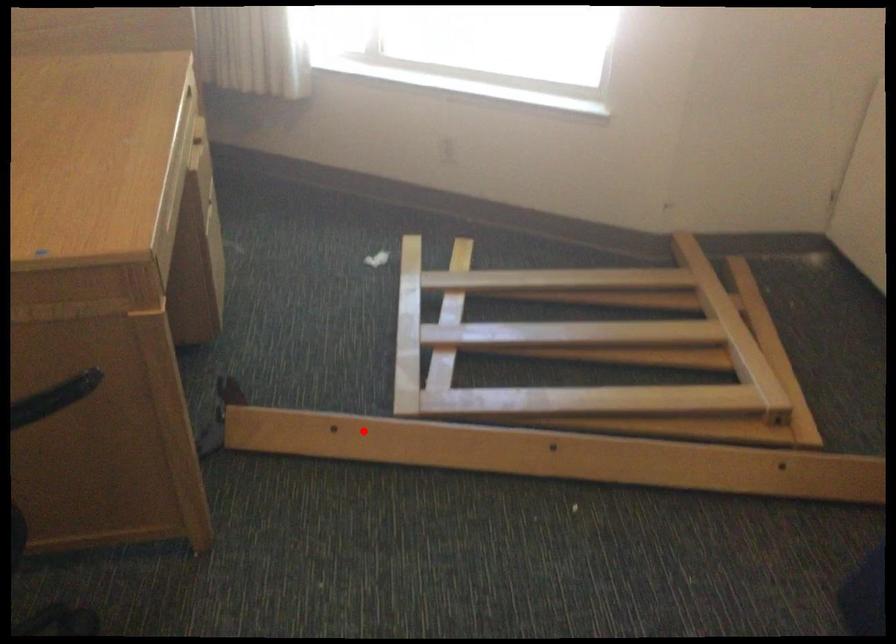
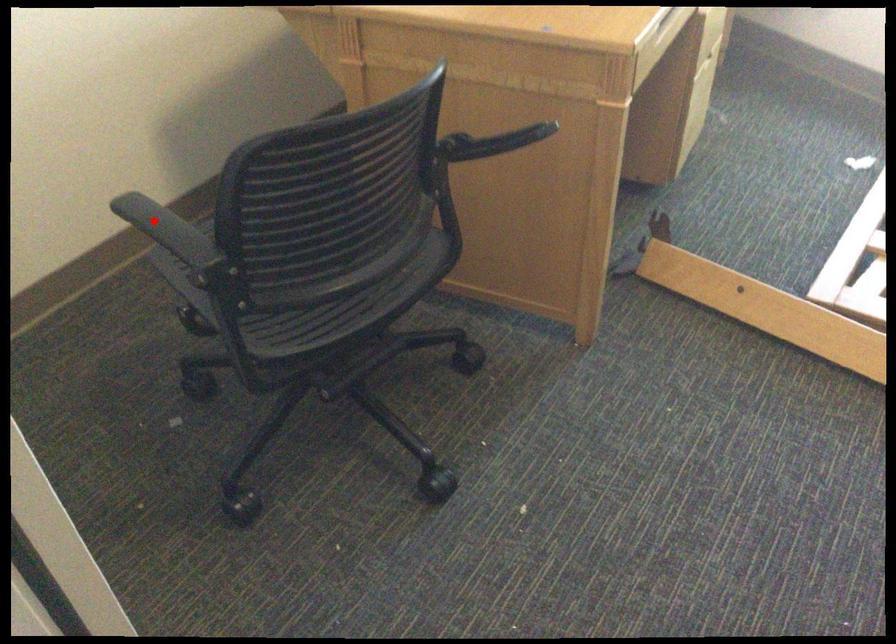
I am providing you with two images of the same scene from different viewpoints. A red point is marked on the first image and another point is marked on the second image. Are the points marked in image1 and image2 representing the same 3D position?

No